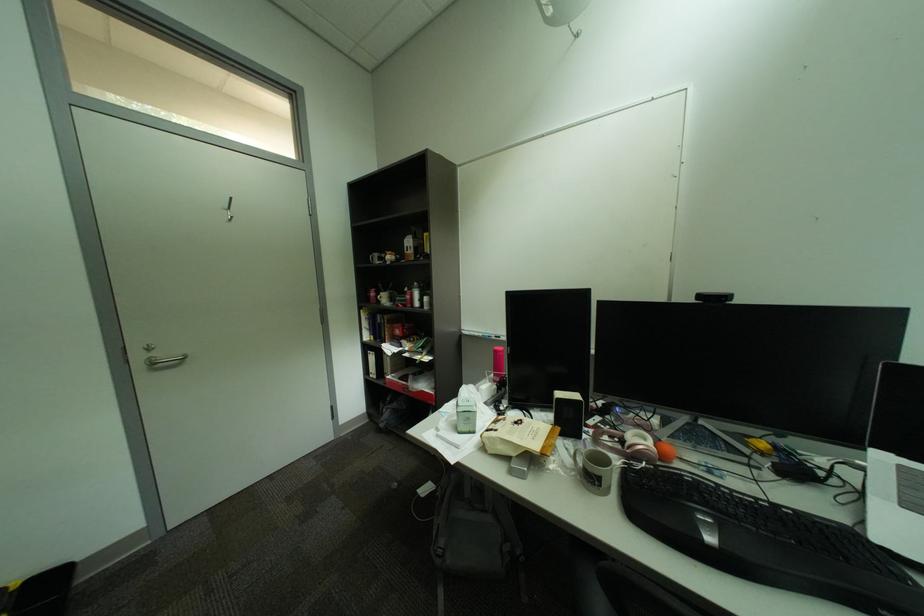
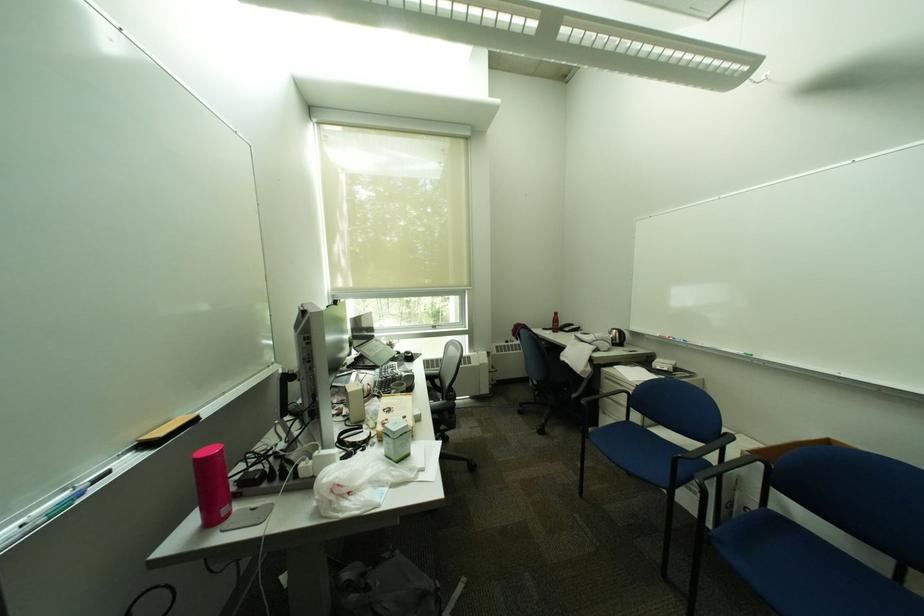
Where in the second image is the point corresponding to point 513,553 from the first image?

(400, 560)